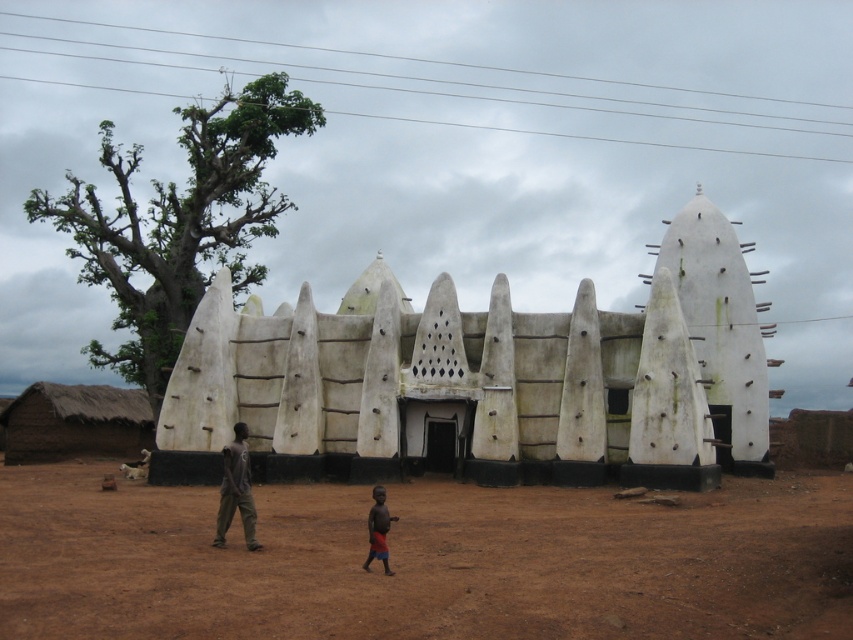
You are standing at the entrance of the traditional building with the pointed cone structures on the roof. You notice a point marked at coordinates (422, 561). Based on the scene description, what does this point most likely represent?

The point at coordinates (422, 561) corresponds to the brown dirt field at center, which is part of the rural setting surrounding the building.